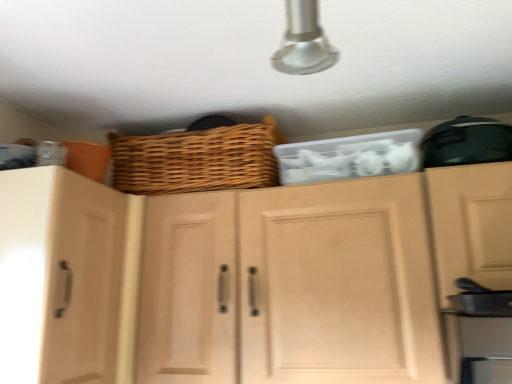
At what (x,y) coordinates should I click in order to perform the action: click on wooden cabinet doors at center, placed as the 2th cabinetry when sorted from left to right. Please return your answer as a coordinate pair (x, y). The width and height of the screenshot is (512, 384). Looking at the image, I should click on pyautogui.click(x=318, y=278).

In order to click on light wood cabinet at left, arranged as the 2th cabinetry when viewed from the right in this screenshot , I will do `click(59, 277)`.

You are a GUI agent. You are given a task and a screenshot of the screen. Output one action in this format:
    pyautogui.click(x=<x>, y=<y>)
    Task: Click on the wooden cabinet doors at center, which ranks as the 1th cabinetry in right-to-left order
    Image resolution: width=512 pixels, height=384 pixels.
    Given the screenshot: What is the action you would take?
    pyautogui.click(x=318, y=278)

Where is `basket behind the light wood cabinet at left, arranged as the 2th cabinetry when viewed from the right`? The image size is (512, 384). basket behind the light wood cabinet at left, arranged as the 2th cabinetry when viewed from the right is located at coordinates (197, 159).

Between woven brown basket at upper center and light wood cabinet at left, arranged as the 2th cabinetry when viewed from the right, which one has smaller width?

woven brown basket at upper center is thinner.

Considering the sizes of woven brown basket at upper center and light wood cabinet at left, arranged as the 2th cabinetry when viewed from the right, in the image, is woven brown basket at upper center taller or shorter than light wood cabinet at left, arranged as the 2th cabinetry when viewed from the right,?

woven brown basket at upper center is shorter than light wood cabinet at left, arranged as the 2th cabinetry when viewed from the right.

Is light wood cabinet at left, arranged as the 2th cabinetry when viewed from the right, turned away from wooden cabinet doors at center, placed as the 2th cabinetry when sorted from left to right?

No.

Which is correct: light wood cabinet at left, arranged as the 2th cabinetry when viewed from the right, is inside wooden cabinet doors at center, which ranks as the 1th cabinetry in right-to-left order, or outside of it?

light wood cabinet at left, arranged as the 2th cabinetry when viewed from the right, is not enclosed by wooden cabinet doors at center, which ranks as the 1th cabinetry in right-to-left order.

What's the angular difference between light wood cabinet at left, which is counted as the first cabinetry, starting from the left, and wooden cabinet doors at center, placed as the 2th cabinetry when sorted from left to right,'s facing directions?

There is a 90.1-degree angle between the facing directions of light wood cabinet at left, which is counted as the first cabinetry, starting from the left, and wooden cabinet doors at center, placed as the 2th cabinetry when sorted from left to right.

Would you say light wood cabinet at left, arranged as the 2th cabinetry when viewed from the right, is a long distance from wooden cabinet doors at center, which ranks as the 1th cabinetry in right-to-left order?

No, light wood cabinet at left, arranged as the 2th cabinetry when viewed from the right, is not far from wooden cabinet doors at center, which ranks as the 1th cabinetry in right-to-left order.

Which object is positioned more to the right, light wood cabinet at left, which is counted as the first cabinetry, starting from the left, or woven brown basket at upper center?

woven brown basket at upper center.

Considering their positions, is light wood cabinet at left, arranged as the 2th cabinetry when viewed from the right, located in front of or behind woven brown basket at upper center?

light wood cabinet at left, arranged as the 2th cabinetry when viewed from the right, is in front of woven brown basket at upper center.

Choose the correct answer: Is light wood cabinet at left, arranged as the 2th cabinetry when viewed from the right, inside woven brown basket at upper center or outside it?

light wood cabinet at left, arranged as the 2th cabinetry when viewed from the right, is not inside woven brown basket at upper center, it's outside.

Which object is thinner, light wood cabinet at left, arranged as the 2th cabinetry when viewed from the right, or woven brown basket at upper center?

woven brown basket at upper center.

Looking at this image, considering the relative sizes of wooden cabinet doors at center, which ranks as the 1th cabinetry in right-to-left order, and woven brown basket at upper center in the image provided, is wooden cabinet doors at center, which ranks as the 1th cabinetry in right-to-left order, smaller than woven brown basket at upper center?

Actually, wooden cabinet doors at center, which ranks as the 1th cabinetry in right-to-left order, might be larger than woven brown basket at upper center.

Is wooden cabinet doors at center, placed as the 2th cabinetry when sorted from left to right, shorter than woven brown basket at upper center?

No.

How distant is wooden cabinet doors at center, placed as the 2th cabinetry when sorted from left to right, from woven brown basket at upper center?

The distance of wooden cabinet doors at center, placed as the 2th cabinetry when sorted from left to right, from woven brown basket at upper center is 10.33 inches.

Is wooden cabinet doors at center, placed as the 2th cabinetry when sorted from left to right, placed right next to woven brown basket at upper center?

No, wooden cabinet doors at center, placed as the 2th cabinetry when sorted from left to right, is not beside woven brown basket at upper center.

Does wooden cabinet doors at center, which ranks as the 1th cabinetry in right-to-left order, turn towards light wood cabinet at left, arranged as the 2th cabinetry when viewed from the right?

Yes, wooden cabinet doors at center, which ranks as the 1th cabinetry in right-to-left order, is turned towards light wood cabinet at left, arranged as the 2th cabinetry when viewed from the right.

Identify the location of cabinetry on the left of wooden cabinet doors at center, placed as the 2th cabinetry when sorted from left to right. (59, 277).

From the image's perspective, is wooden cabinet doors at center, placed as the 2th cabinetry when sorted from left to right, under light wood cabinet at left, which is counted as the first cabinetry, starting from the left?

Indeed, from the image's perspective, wooden cabinet doors at center, placed as the 2th cabinetry when sorted from left to right, is shown beneath light wood cabinet at left, which is counted as the first cabinetry, starting from the left.

Does point (494, 354) appear closer or farther from the camera than point (83, 306)?

Clearly, point (494, 354) is closer to the camera than point (83, 306).

Could you measure the distance between woven brown basket at upper center and wooden cabinet doors at center, which ranks as the 1th cabinetry in right-to-left order?

The distance of woven brown basket at upper center from wooden cabinet doors at center, which ranks as the 1th cabinetry in right-to-left order, is 10.33 inches.

From the picture: Choose the correct answer: Is woven brown basket at upper center inside wooden cabinet doors at center, which ranks as the 1th cabinetry in right-to-left order, or outside it?

woven brown basket at upper center lies outside wooden cabinet doors at center, which ranks as the 1th cabinetry in right-to-left order.

Where is `cabinetry that appears on the right of woven brown basket at upper center`? The height and width of the screenshot is (384, 512). cabinetry that appears on the right of woven brown basket at upper center is located at coordinates (318, 278).

Is woven brown basket at upper center looking in the opposite direction of wooden cabinet doors at center, placed as the 2th cabinetry when sorted from left to right?

No.

Find the location of a particular element. The height and width of the screenshot is (384, 512). cabinetry that is on the left side of woven brown basket at upper center is located at coordinates (59, 277).

Identify the location of cabinetry above the wooden cabinet doors at center, which ranks as the 1th cabinetry in right-to-left order (from the image's perspective). (59, 277).

Based on their spatial positions, is light wood cabinet at left, which is counted as the first cabinetry, starting from the left, or wooden cabinet doors at center, which ranks as the 1th cabinetry in right-to-left order, closer to woven brown basket at upper center?

wooden cabinet doors at center, which ranks as the 1th cabinetry in right-to-left order, lies closer to woven brown basket at upper center than the other object.

From the image, which object appears to be nearer to light wood cabinet at left, arranged as the 2th cabinetry when viewed from the right, woven brown basket at upper center or wooden cabinet doors at center, which ranks as the 1th cabinetry in right-to-left order?

The object closer to light wood cabinet at left, arranged as the 2th cabinetry when viewed from the right, is wooden cabinet doors at center, which ranks as the 1th cabinetry in right-to-left order.

When comparing their distances from wooden cabinet doors at center, placed as the 2th cabinetry when sorted from left to right, does light wood cabinet at left, arranged as the 2th cabinetry when viewed from the right, or woven brown basket at upper center seem further?

Based on the image, woven brown basket at upper center appears to be further to wooden cabinet doors at center, placed as the 2th cabinetry when sorted from left to right.

Estimate the real-world distances between objects in this image. Which object is further from wooden cabinet doors at center, which ranks as the 1th cabinetry in right-to-left order, woven brown basket at upper center or light wood cabinet at left, arranged as the 2th cabinetry when viewed from the right?

Based on the image, woven brown basket at upper center appears to be further to wooden cabinet doors at center, which ranks as the 1th cabinetry in right-to-left order.

Looking at this image, from the image, which object appears to be farther from woven brown basket at upper center, wooden cabinet doors at center, which ranks as the 1th cabinetry in right-to-left order, or light wood cabinet at left, arranged as the 2th cabinetry when viewed from the right?

light wood cabinet at left, arranged as the 2th cabinetry when viewed from the right, is positioned further to the anchor woven brown basket at upper center.

Consider the image. Which object lies further to the anchor point light wood cabinet at left, arranged as the 2th cabinetry when viewed from the right, wooden cabinet doors at center, placed as the 2th cabinetry when sorted from left to right, or woven brown basket at upper center?

woven brown basket at upper center is further to light wood cabinet at left, arranged as the 2th cabinetry when viewed from the right.

Find the location of a particular element. This screenshot has height=384, width=512. basket situated between light wood cabinet at left, arranged as the 2th cabinetry when viewed from the right, and wooden cabinet doors at center, which ranks as the 1th cabinetry in right-to-left order, from left to right is located at coordinates (197, 159).